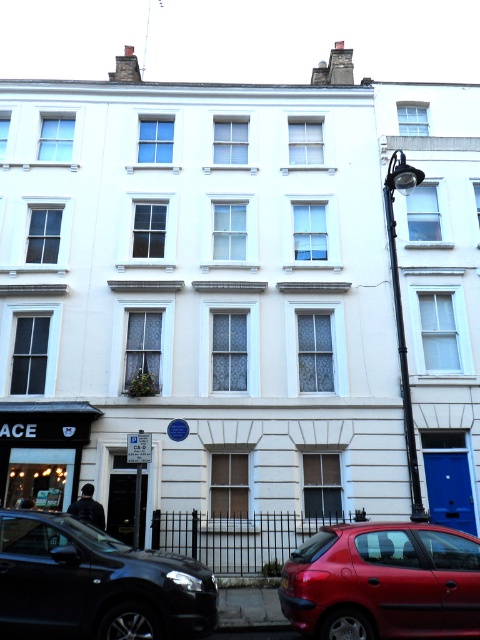
Question: Which of the following is the farthest from the observer?

Choices:
 (A) (116, 547)
 (B) (300, 554)

Answer: (B)

Question: Does shiny black suv at lower left appear under glossy red car at lower right?

Choices:
 (A) no
 (B) yes

Answer: (A)

Question: Is shiny black suv at lower left below glossy red car at lower right?

Choices:
 (A) yes
 (B) no

Answer: (B)

Question: Is shiny black suv at lower left thinner than glossy red car at lower right?

Choices:
 (A) yes
 (B) no

Answer: (B)

Question: Which point is closer to the camera?

Choices:
 (A) (81, 596)
 (B) (328, 604)

Answer: (A)